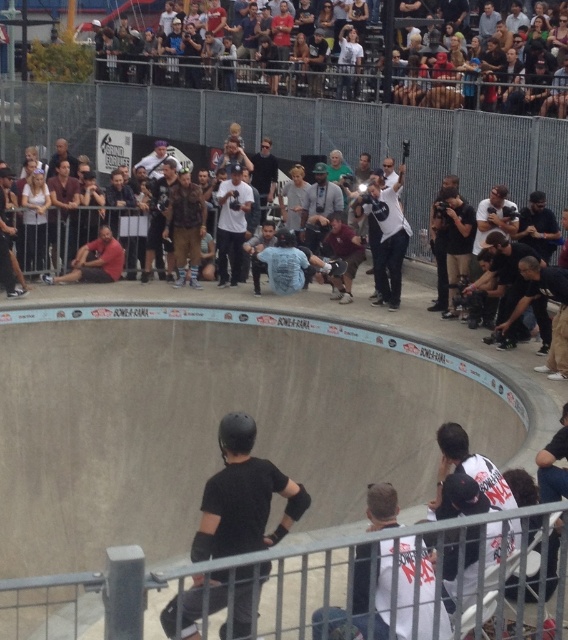
Is smooth concrete bowl at center to the left of white cotton tank top at upper left from the viewer's perspective?

In fact, smooth concrete bowl at center is to the right of white cotton tank top at upper left.

Does smooth concrete bowl at center appear over white cotton tank top at upper left?

No, smooth concrete bowl at center is not above white cotton tank top at upper left.

Is point (2, 406) farther from viewer compared to point (45, 202)?

No, it is not.

Where is `smooth concrete bowl at center`? smooth concrete bowl at center is located at coordinates (194, 483).

Does dark gray concrete crowd at upper center have a larger size compared to white cotton shirt at center?

Yes, dark gray concrete crowd at upper center is bigger than white cotton shirt at center.

Based on the photo, is dark gray concrete crowd at upper center positioned in front of white cotton shirt at center?

Yes.

Identify the location of dark gray concrete crowd at upper center. (360, 77).

Is smooth concrete bowl at center thinner than black matte skateboard at center?

Incorrect, smooth concrete bowl at center's width is not less than black matte skateboard at center's.

Can you confirm if smooth concrete bowl at center is positioned to the left of black matte skateboard at center?

Indeed, smooth concrete bowl at center is positioned on the left side of black matte skateboard at center.

Does point (123, 448) lie in front of point (340, 608)?

No.

Identify the location of smooth concrete bowl at center. (194, 483).